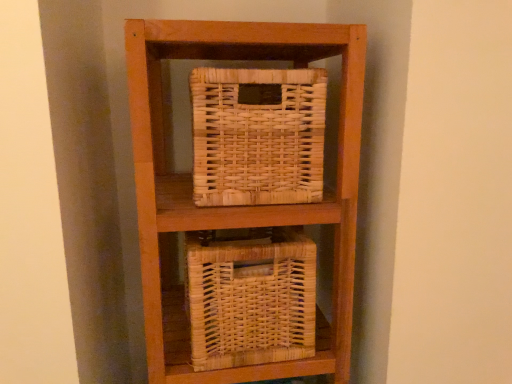
Question: Which direction should I rotate to face natural wicker basket at upper center, placed as the first basket when sorted from top to bottom, — up or down?

Choices:
 (A) down
 (B) up

Answer: (B)

Question: Would you consider natural wicker basket at lower center, positioned as the 2th basket in top-to-bottom order, to be distant from natural wicker basket at upper center, the second basket from the bottom?

Choices:
 (A) no
 (B) yes

Answer: (A)

Question: From a real-world perspective, is natural wicker basket at lower center, positioned as the 2th basket in top-to-bottom order, under natural wicker basket at upper center, placed as the first basket when sorted from top to bottom?

Choices:
 (A) yes
 (B) no

Answer: (A)

Question: Considering the relative sizes of natural wicker basket at lower center, positioned as the first basket in bottom-to-top order, and natural wicker basket at upper center, the second basket from the bottom, in the image provided, is natural wicker basket at lower center, positioned as the first basket in bottom-to-top order, taller than natural wicker basket at upper center, the second basket from the bottom,?

Choices:
 (A) no
 (B) yes

Answer: (B)

Question: Considering the relative positions of natural wicker basket at lower center, positioned as the 2th basket in top-to-bottom order, and natural wicker basket at upper center, placed as the first basket when sorted from top to bottom, in the image provided, is natural wicker basket at lower center, positioned as the 2th basket in top-to-bottom order, to the left of natural wicker basket at upper center, placed as the first basket when sorted from top to bottom, from the viewer's perspective?

Choices:
 (A) no
 (B) yes

Answer: (B)

Question: Is natural wicker basket at lower center, positioned as the 2th basket in top-to-bottom order, positioned in front of natural wicker basket at upper center, the second basket from the bottom?

Choices:
 (A) no
 (B) yes

Answer: (A)

Question: Is natural wicker basket at lower center, positioned as the first basket in bottom-to-top order, bigger than natural wicker basket at upper center, the second basket from the bottom?

Choices:
 (A) yes
 (B) no

Answer: (A)

Question: Considering the relative positions of natural wicker basket at upper center, placed as the first basket when sorted from top to bottom, and natural wicker basket at lower center, positioned as the first basket in bottom-to-top order, in the image provided, is natural wicker basket at upper center, placed as the first basket when sorted from top to bottom, to the right of natural wicker basket at lower center, positioned as the first basket in bottom-to-top order, from the viewer's perspective?

Choices:
 (A) yes
 (B) no

Answer: (A)

Question: Is natural wicker basket at upper center, placed as the first basket when sorted from top to bottom, wider than natural wicker basket at lower center, positioned as the 2th basket in top-to-bottom order?

Choices:
 (A) no
 (B) yes

Answer: (A)

Question: Is the depth of natural wicker basket at upper center, placed as the first basket when sorted from top to bottom, less than that of natural wicker basket at lower center, positioned as the 2th basket in top-to-bottom order?

Choices:
 (A) yes
 (B) no

Answer: (A)

Question: Is natural wicker basket at upper center, the second basket from the bottom, oriented towards natural wicker basket at lower center, positioned as the 2th basket in top-to-bottom order?

Choices:
 (A) no
 (B) yes

Answer: (A)

Question: Is natural wicker basket at upper center, placed as the first basket when sorted from top to bottom, located outside natural wicker basket at lower center, positioned as the 2th basket in top-to-bottom order?

Choices:
 (A) yes
 (B) no

Answer: (A)

Question: Can you confirm if natural wicker basket at upper center, the second basket from the bottom, is smaller than natural wicker basket at lower center, positioned as the first basket in bottom-to-top order?

Choices:
 (A) yes
 (B) no

Answer: (A)

Question: From a real-world perspective, is natural wicker basket at lower center, positioned as the first basket in bottom-to-top order, above or below natural wicker basket at upper center, the second basket from the bottom?

Choices:
 (A) below
 (B) above

Answer: (A)